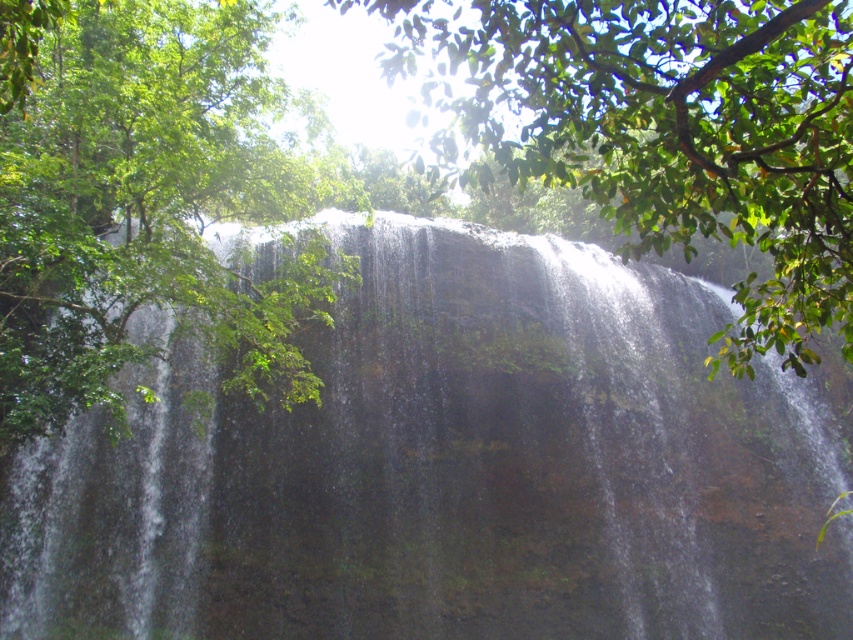
Question: Does green leafy tree at upper left have a larger size compared to green leafy tree at center?

Choices:
 (A) no
 (B) yes

Answer: (A)

Question: Is clear water at center smaller than green leafy tree at center?

Choices:
 (A) yes
 (B) no

Answer: (A)

Question: Is clear water at center bigger than green leafy tree at upper left?

Choices:
 (A) yes
 (B) no

Answer: (A)

Question: Estimate the real-world distances between objects in this image. Which object is farther from the green leafy tree at upper left?

Choices:
 (A) green leafy tree at center
 (B) clear water at center

Answer: (B)

Question: Estimate the real-world distances between objects in this image. Which object is farther from the clear water at center?

Choices:
 (A) green leafy tree at upper left
 (B) green leafy tree at center

Answer: (A)

Question: Among these points, which one is nearest to the camera?

Choices:
 (A) (202, 56)
 (B) (517, 176)

Answer: (B)